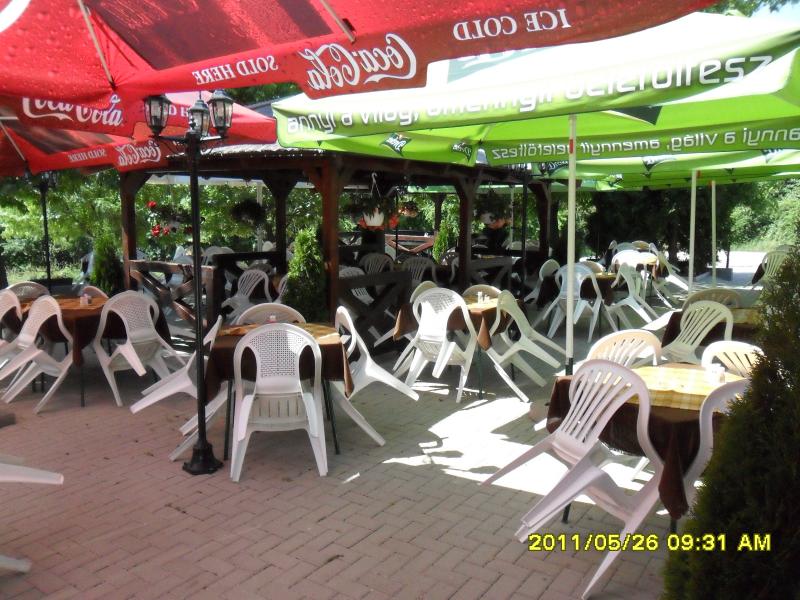
At what (x,y) coordinates should I click in order to perform the action: click on floor. Please return your answer as a coordinate pair (x, y). The width and height of the screenshot is (800, 600). Looking at the image, I should click on (446, 435), (366, 571), (104, 464).